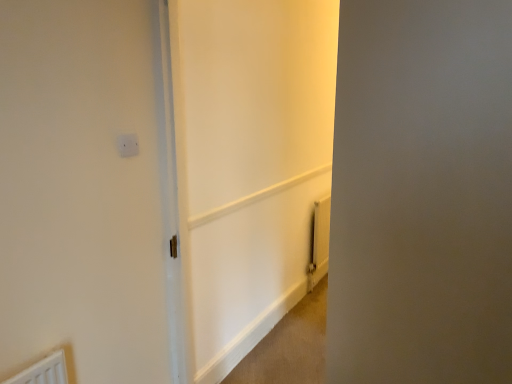
Question: Does white plastic electric outlet at upper center have a smaller size compared to white glossy door at center, placed as the 2th screen door when sorted from right to left?

Choices:
 (A) no
 (B) yes

Answer: (B)

Question: Is white glossy door at center, placed as the 2th screen door when sorted from right to left, inside white plastic electric outlet at upper center?

Choices:
 (A) no
 (B) yes

Answer: (A)

Question: Considering the relative sizes of white plastic electric outlet at upper center and white glossy door at center, placed as the 2th screen door when sorted from right to left, in the image provided, is white plastic electric outlet at upper center thinner than white glossy door at center, placed as the 2th screen door when sorted from right to left,?

Choices:
 (A) yes
 (B) no

Answer: (A)

Question: Does white plastic electric outlet at upper center have a greater width compared to white glossy door at center, placed as the 2th screen door when sorted from right to left?

Choices:
 (A) yes
 (B) no

Answer: (B)

Question: From the image's perspective, is white plastic electric outlet at upper center over white glossy door at center, which is the 1th screen door in left-to-right order?

Choices:
 (A) yes
 (B) no

Answer: (A)

Question: Relative to white plastic electric outlet at upper center, is yellow metallic radiator at lower right in front or behind?

Choices:
 (A) front
 (B) behind

Answer: (B)

Question: In terms of height, does yellow metallic radiator at lower right look taller or shorter compared to white plastic electric outlet at upper center?

Choices:
 (A) tall
 (B) short

Answer: (A)

Question: Considering the positions of yellow metallic radiator at lower right and white plastic electric outlet at upper center in the image, is yellow metallic radiator at lower right wider or thinner than white plastic electric outlet at upper center?

Choices:
 (A) thin
 (B) wide

Answer: (B)

Question: In terms of size, does yellow metallic radiator at lower right appear bigger or smaller than white plastic electric outlet at upper center?

Choices:
 (A) small
 (B) big

Answer: (B)

Question: Is white matte screen door at right, the 2th screen door from the left, in front of or behind yellow metallic radiator at lower right in the image?

Choices:
 (A) front
 (B) behind

Answer: (A)

Question: From a real-world perspective, relative to yellow metallic radiator at lower right, is white matte screen door at right, the 1th screen door positioned from the right, vertically above or below?

Choices:
 (A) above
 (B) below

Answer: (A)

Question: From the image's perspective, is white matte screen door at right, the 2th screen door from the left, positioned above or below yellow metallic radiator at lower right?

Choices:
 (A) below
 (B) above

Answer: (B)

Question: In terms of height, does white matte screen door at right, the 2th screen door from the left, look taller or shorter compared to yellow metallic radiator at lower right?

Choices:
 (A) tall
 (B) short

Answer: (A)

Question: Is yellow metallic radiator at lower right to the left or to the right of white glossy door at center, placed as the 2th screen door when sorted from right to left, in the image?

Choices:
 (A) right
 (B) left

Answer: (A)

Question: From the image's perspective, is yellow metallic radiator at lower right positioned above or below white glossy door at center, placed as the 2th screen door when sorted from right to left?

Choices:
 (A) below
 (B) above

Answer: (A)